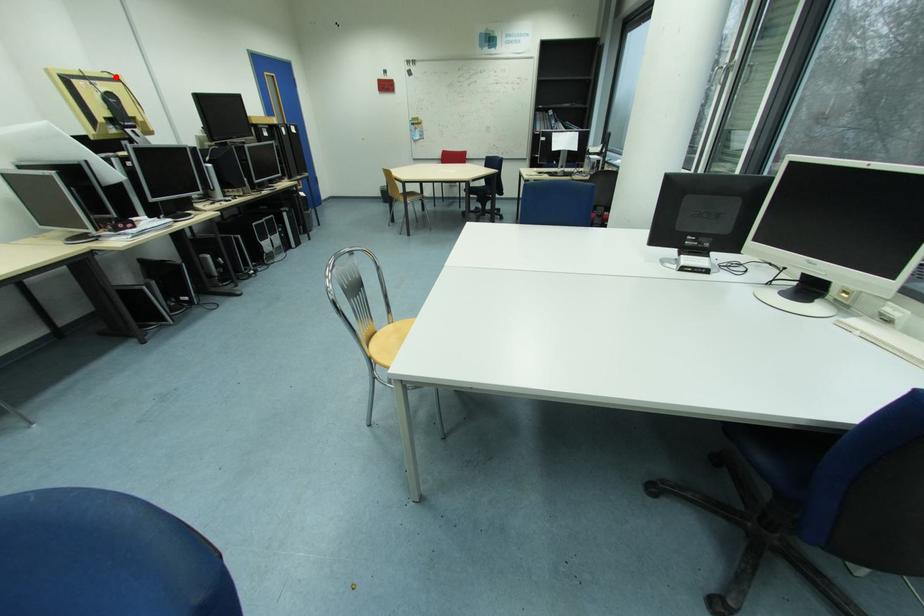
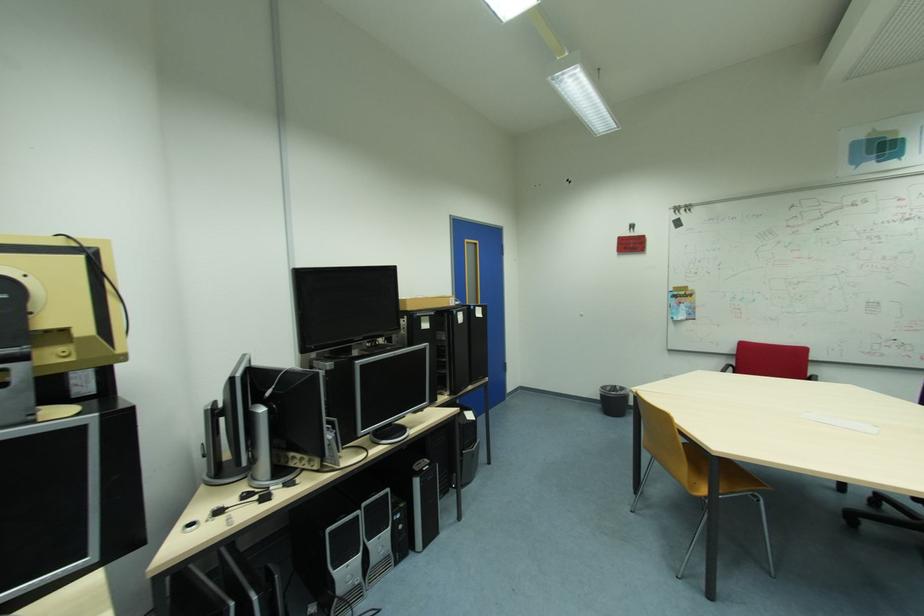
The point at the highlighted location is marked in the first image. Where is the corresponding point in the second image?

(66, 244)